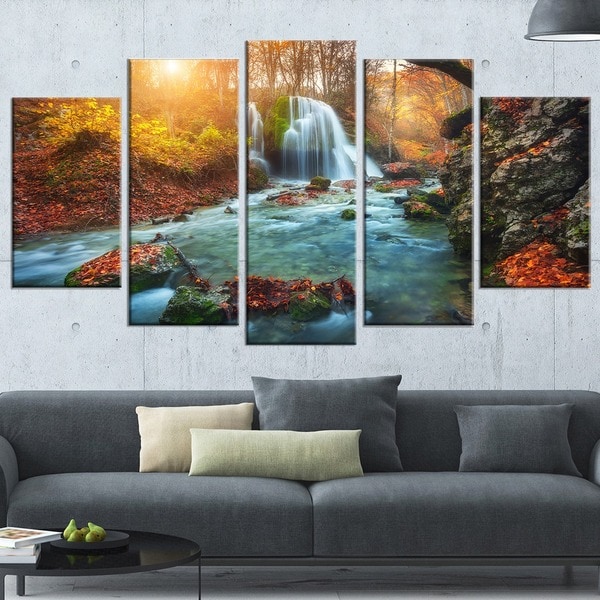
Locate an element on the screen. This screenshot has width=600, height=600. grey pillows is located at coordinates (358, 378), (530, 440).